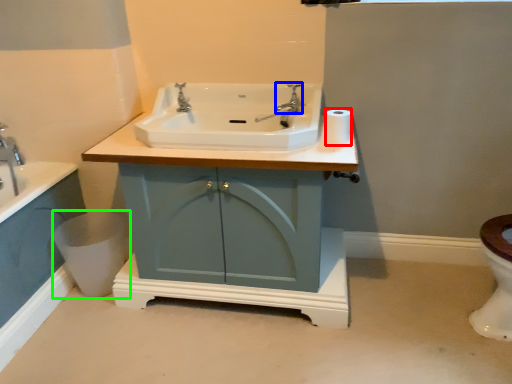
Question: Which object is positioned farthest from toilet paper (highlighted by a red box)? Select from plumbing fixture (highlighted by a blue box) and toilet bowl (highlighted by a green box).

Choices:
 (A) plumbing fixture
 (B) toilet bowl

Answer: (B)